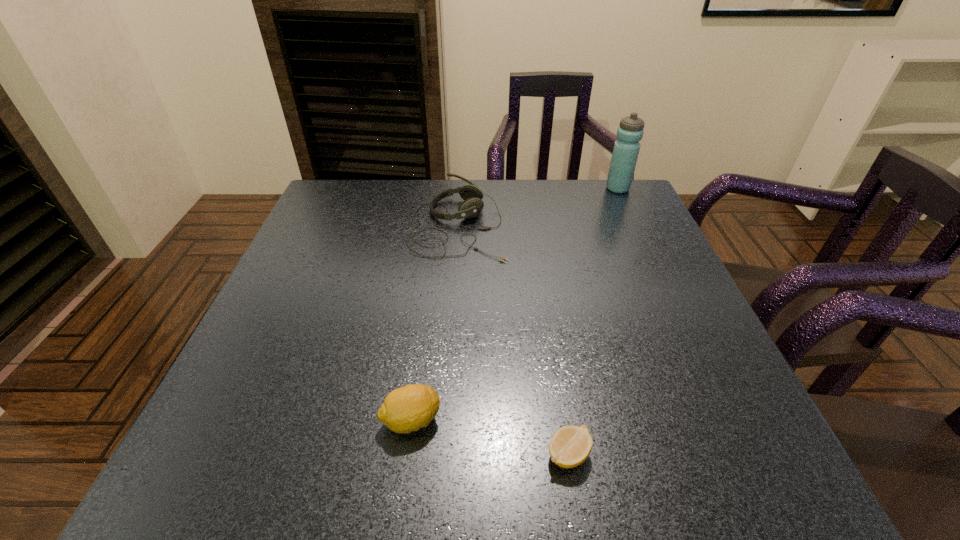
Identify which object is the second nearest to the rightmost object. Please provide its 2D coordinates. Your answer should be formatted as a tuple, i.e. [(x, y)], where the tuple contains the x and y coordinates of a point satisfying the conditions above.

[(570, 446)]

At what (x,y) coordinates should I click in order to perform the action: click on free spot that satisfies the following two spatial constraints: 1. on the back side of the third object from left to right; 2. on the outer surface of the third nearest object. Please return your answer as a coordinate pair (x, y). Looking at the image, I should click on (533, 226).

At what (x,y) coordinates should I click in order to perform the action: click on vacant space that satisfies the following two spatial constraints: 1. on the back side of the shortest object; 2. at the stem end of the left lemon. Please return your answer as a coordinate pair (x, y). This screenshot has width=960, height=540. Looking at the image, I should click on (563, 420).

Locate an element on the screen. The height and width of the screenshot is (540, 960). vacant area that satisfies the following two spatial constraints: 1. on the back side of the third object from left to right; 2. on the outer surface of the headset is located at coordinates (533, 226).

I want to click on blank area in the image that satisfies the following two spatial constraints: 1. at the stem end of the left lemon; 2. on the left side of the shorter lemon, so click(x=406, y=454).

Find the location of a particular element. The image size is (960, 540). vacant space that satisfies the following two spatial constraints: 1. on the outer surface of the headset; 2. on the back side of the shortest object is located at coordinates (444, 454).

Where is `vacant space that satisfies the following two spatial constraints: 1. on the front side of the tallest object; 2. on the outer surface of the headset`? The height and width of the screenshot is (540, 960). vacant space that satisfies the following two spatial constraints: 1. on the front side of the tallest object; 2. on the outer surface of the headset is located at coordinates (636, 226).